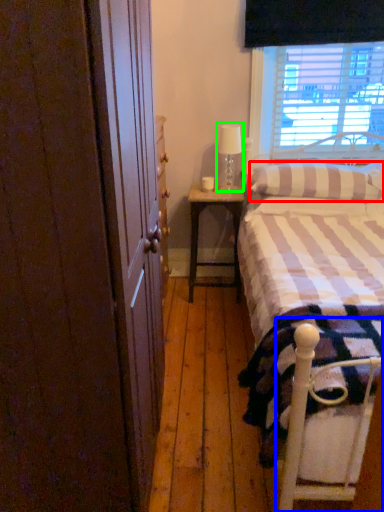
Question: Based on their relative distances, which object is farther from pillow (highlighted by a red box)? Choose from bed frame (highlighted by a blue box) and table lamp (highlighted by a green box).

Choices:
 (A) bed frame
 (B) table lamp

Answer: (A)